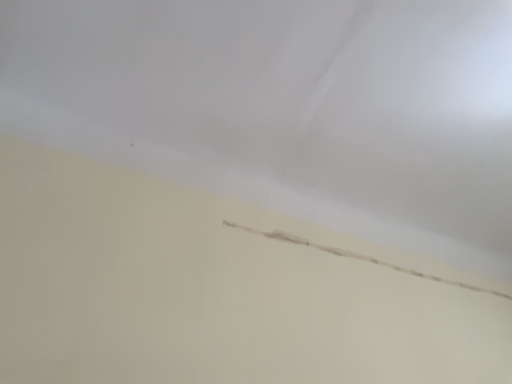
Locate an element on the screen. This screenshot has height=384, width=512. smooth beige crack at upper center is located at coordinates (359, 257).

Measure the distance between point (502,295) and camera.

A distance of 7.80 feet exists between point (502,295) and camera.

Describe the element at coordinates (359, 257) in the screenshot. I see `smooth beige crack at upper center` at that location.

Locate an element on the screen. This screenshot has width=512, height=384. smooth beige crack at upper center is located at coordinates (359, 257).